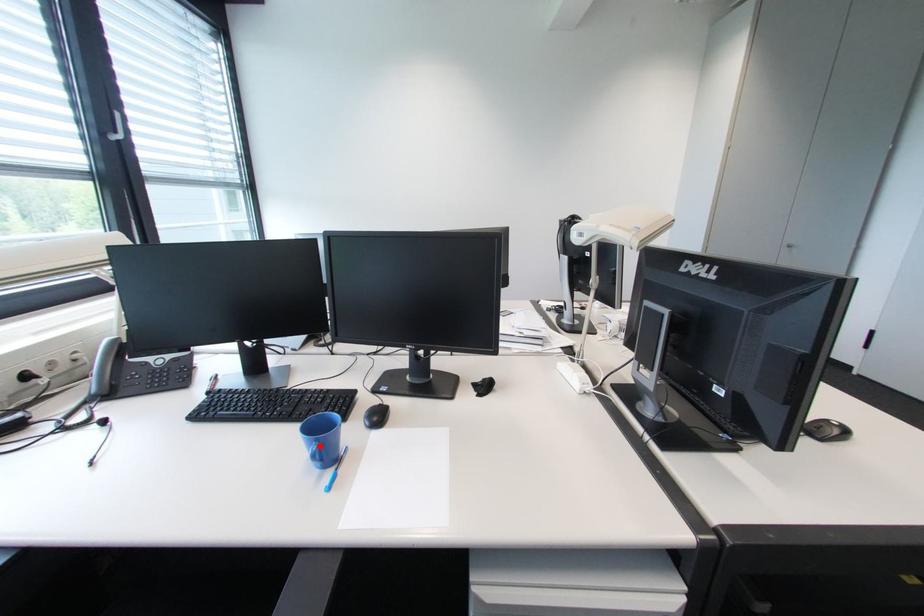
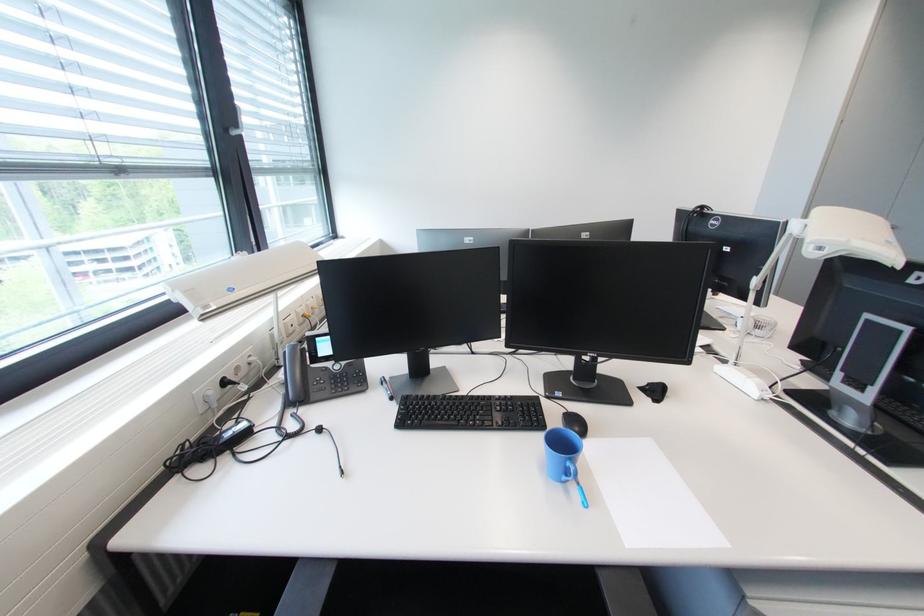
Where in the second image is the point corresponding to the highlighted location from the first image?

(575, 464)